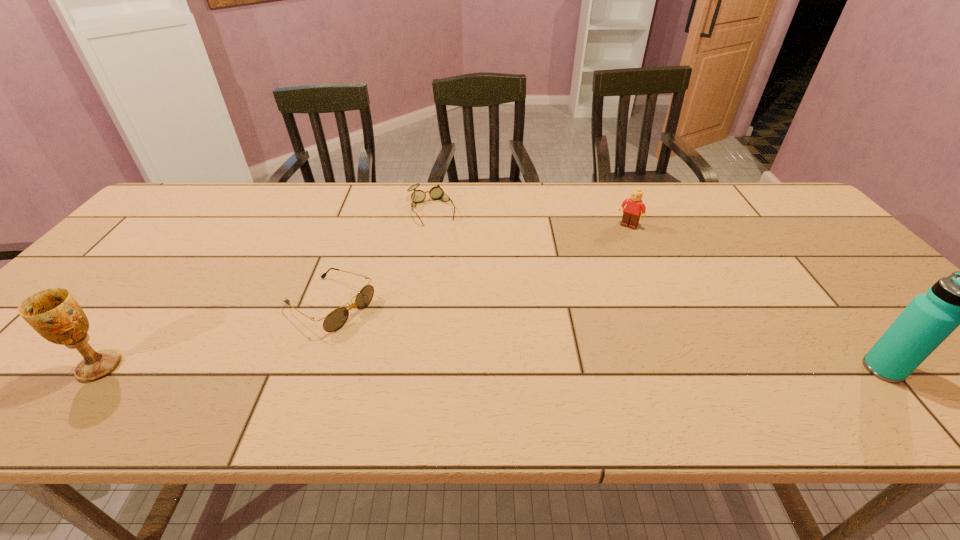
Find the location of `free space between the fourth shortest object and the shortest object`. free space between the fourth shortest object and the shortest object is located at coordinates (265, 288).

Locate an element on the screen. This screenshot has width=960, height=540. free spot between the third object from left to right and the second object from left to right is located at coordinates (380, 258).

You are a GUI agent. You are given a task and a screenshot of the screen. Output one action in this format:
    pyautogui.click(x=<x>, y=<y>)
    Task: Click on the object that is the second nearest to the Lego
    
    Given the screenshot: What is the action you would take?
    pyautogui.click(x=959, y=299)

Identify which object is the closest to the fourth shortest object. Please provide its 2D coordinates. Your answer should be formatted as a tuple, i.e. [(x, y)], where the tuple contains the x and y coordinates of a point satisfying the conditions above.

[(336, 319)]

Where is `free space that satisfies the following two spatial constraints: 1. on the front side of the water bottle; 2. on the right side of the spectacles`? Image resolution: width=960 pixels, height=540 pixels. free space that satisfies the following two spatial constraints: 1. on the front side of the water bottle; 2. on the right side of the spectacles is located at coordinates (406, 369).